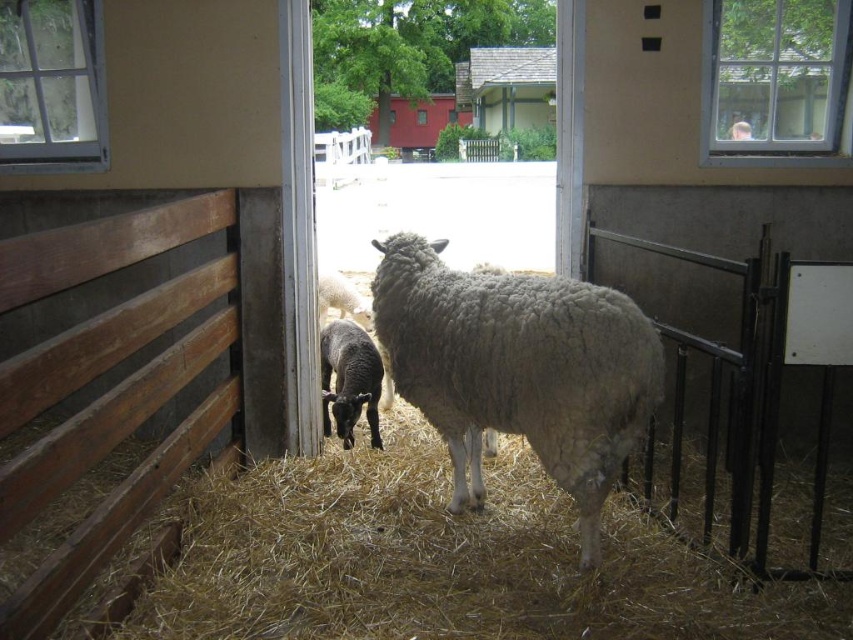
Question: Which point is closer to the camera?

Choices:
 (A) (323, 314)
 (B) (735, 134)
 (C) (637, 413)

Answer: (C)

Question: Can you confirm if fuzzy woolly sheep at center is positioned above black woolly lamb at center?

Choices:
 (A) no
 (B) yes

Answer: (B)

Question: Which point appears closest to the camera in this image?

Choices:
 (A) (610, 440)
 (B) (592, 598)

Answer: (B)

Question: Considering the real-world distances, which object is closest to the black woolly lamb at center?

Choices:
 (A) light brown straw at center
 (B) smooth plastic cup at upper right

Answer: (A)

Question: Is fuzzy woolly sheep at center closer to camera compared to black woolly lamb at center?

Choices:
 (A) no
 (B) yes

Answer: (B)

Question: Does light brown straw at center appear under white woolen lamb at center?

Choices:
 (A) no
 (B) yes

Answer: (B)